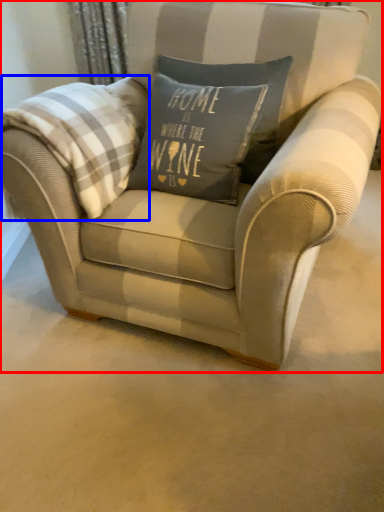
Question: Which point is further to the camera, chair (highlighted by a red box) or plaid (highlighted by a blue box)?

Choices:
 (A) chair
 (B) plaid

Answer: (B)